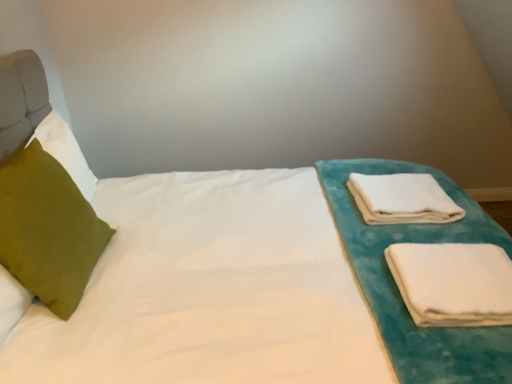
Question: From the image's perspective, is white soft cloth at right, marked as the second cloth in a back-to-front arrangement, positioned above or below white soft towel at right, the second cloth from the front?

Choices:
 (A) below
 (B) above

Answer: (A)

Question: In the image, is white soft cloth at right, the 2th cloth in the top-to-bottom sequence, on the left side or the right side of white soft towel at right, the second cloth from the front?

Choices:
 (A) right
 (B) left

Answer: (A)

Question: Which is farther from the green velvet pillow at left?

Choices:
 (A) white soft cloth at right, which is the first cloth from bottom to top
 (B) white soft towel at right, which is the 1th cloth from back to front

Answer: (B)

Question: Which is nearer to the white soft towel at right, which is the 1th cloth from back to front?

Choices:
 (A) white soft cloth at right, the 2th cloth in the top-to-bottom sequence
 (B) green velvet pillow at left

Answer: (A)